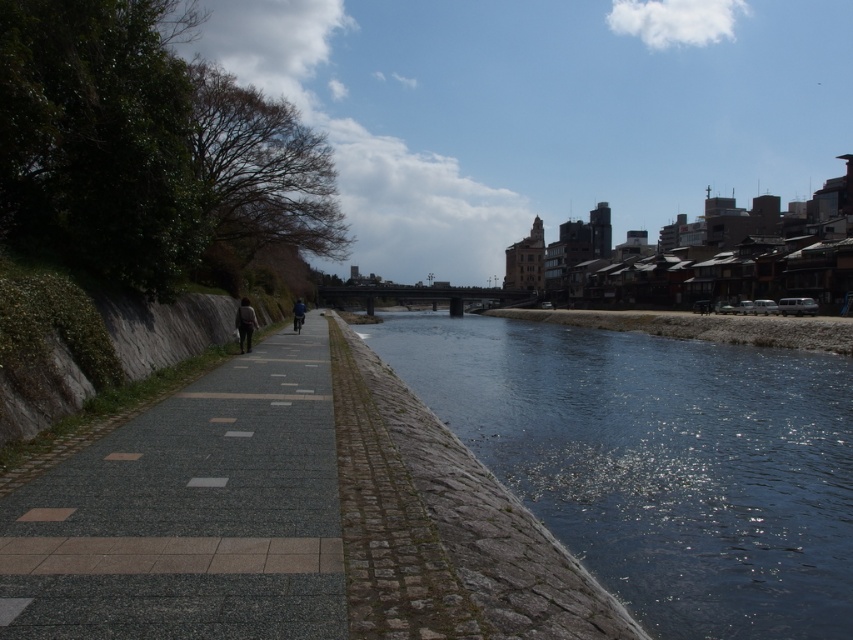
You are standing on the riverside pathway and want to toss a pebble into the dark blue water at center. Based on the distance provided, will the pebble reach the water if you throw it with an average adult arm strength?

The dark blue water at center is 24.48 feet away from the viewer. An average adult can throw a pebble about 20 to 30 feet, so it is possible to reach the water with a strong throw.